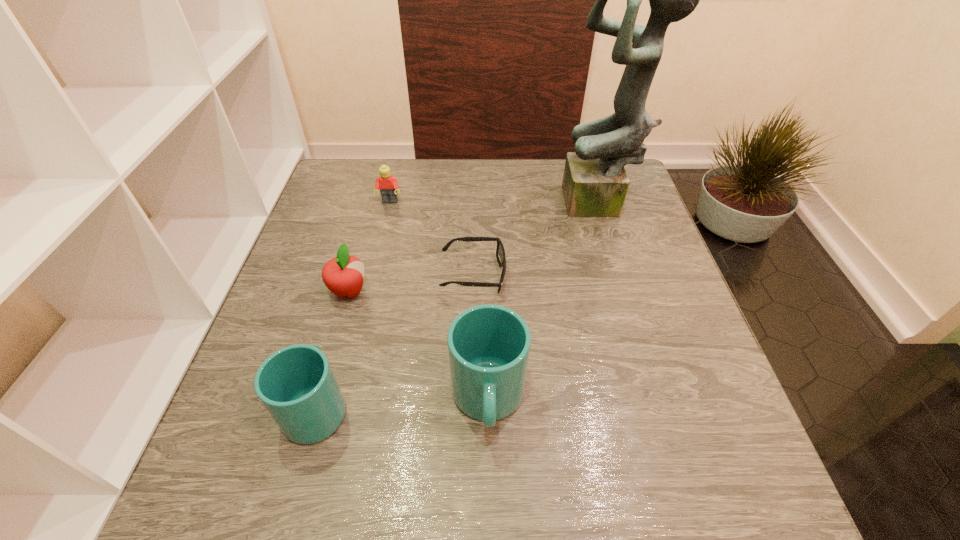
Find the location of a particular element. The image size is (960, 540). vacant space at the far right corner is located at coordinates (629, 173).

The width and height of the screenshot is (960, 540). I want to click on free space between the apple and the taller cup, so click(x=419, y=346).

The height and width of the screenshot is (540, 960). Identify the location of vacant space that's between the sculpture and the Lego. (494, 204).

Image resolution: width=960 pixels, height=540 pixels. Find the location of `free spot between the sunglasses and the sculpture`. free spot between the sunglasses and the sculpture is located at coordinates (537, 240).

Image resolution: width=960 pixels, height=540 pixels. Find the location of `vacant area that lies between the apple and the taller cup`. vacant area that lies between the apple and the taller cup is located at coordinates (419, 346).

Image resolution: width=960 pixels, height=540 pixels. I want to click on vacant area between the Lego and the second tallest object, so click(x=439, y=301).

The image size is (960, 540). I want to click on free area in between the sculpture and the Lego, so click(494, 204).

The image size is (960, 540). What are the coordinates of `vacant area that lies between the left cup and the fifth shortest object` in the screenshot? It's located at (402, 403).

Locate an element on the screen. The width and height of the screenshot is (960, 540). free space between the left cup and the tallest object is located at coordinates pos(459,306).

Where is `object that is the fourth closest to the shortest object`? The image size is (960, 540). object that is the fourth closest to the shortest object is located at coordinates pos(388,185).